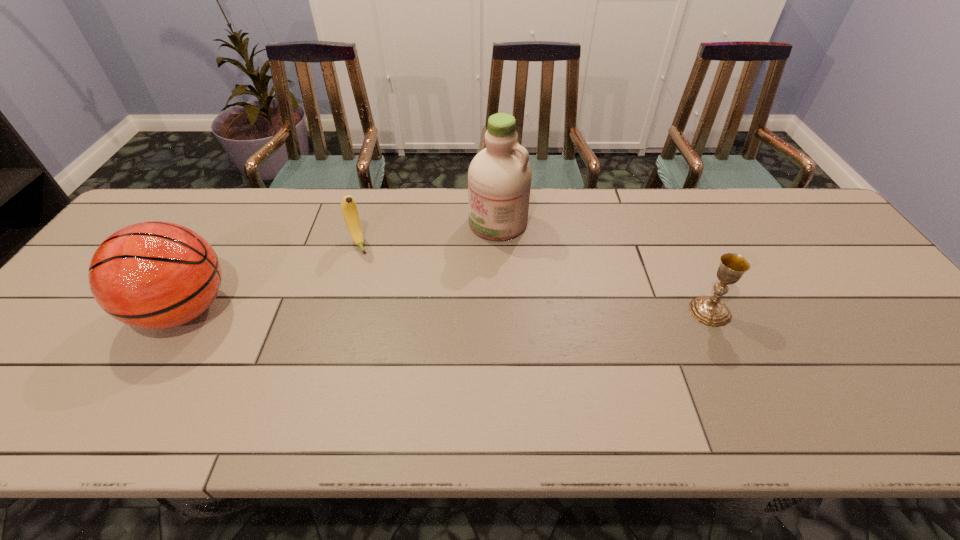
Identify which object is the third closest to the third object from left to right. Please provide its 2D coordinates. Your answer should be formatted as a tuple, i.e. [(x, y)], where the tuple contains the x and y coordinates of a point satisfying the conditions above.

[(154, 275)]

Find the location of a particular element. This screenshot has width=960, height=540. object that stands as the third closest to the banana is located at coordinates (710, 311).

At what (x,y) coordinates should I click in order to perform the action: click on free space that satisfies the following two spatial constraints: 1. on the front side of the rightmost object; 2. on the right side of the cleansing agent. Please return your answer as a coordinate pair (x, y). The width and height of the screenshot is (960, 540). Looking at the image, I should click on (502, 312).

Image resolution: width=960 pixels, height=540 pixels. What are the coordinates of `free space that satisfies the following two spatial constraints: 1. on the front side of the third object from right to left; 2. on the left side of the rightmost object` in the screenshot? It's located at tap(339, 312).